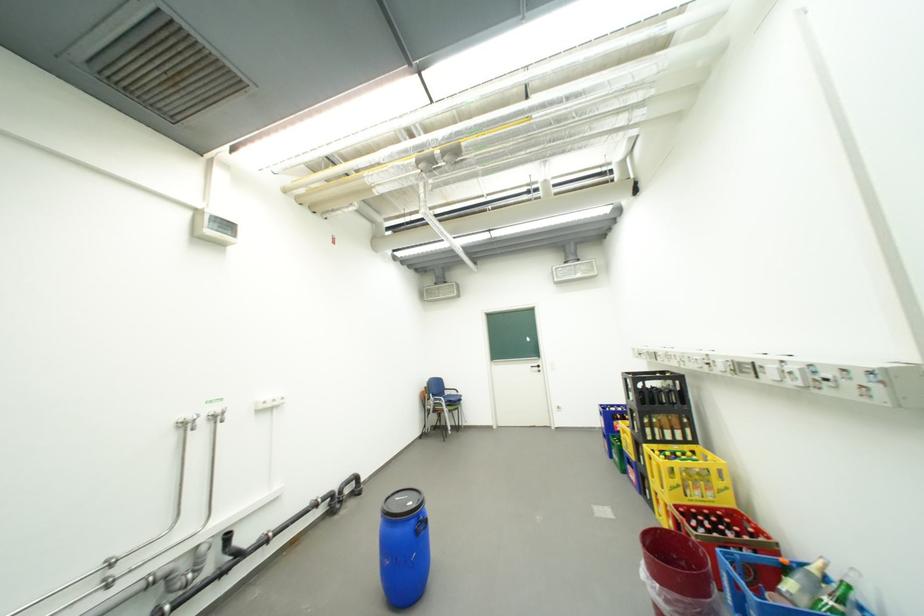
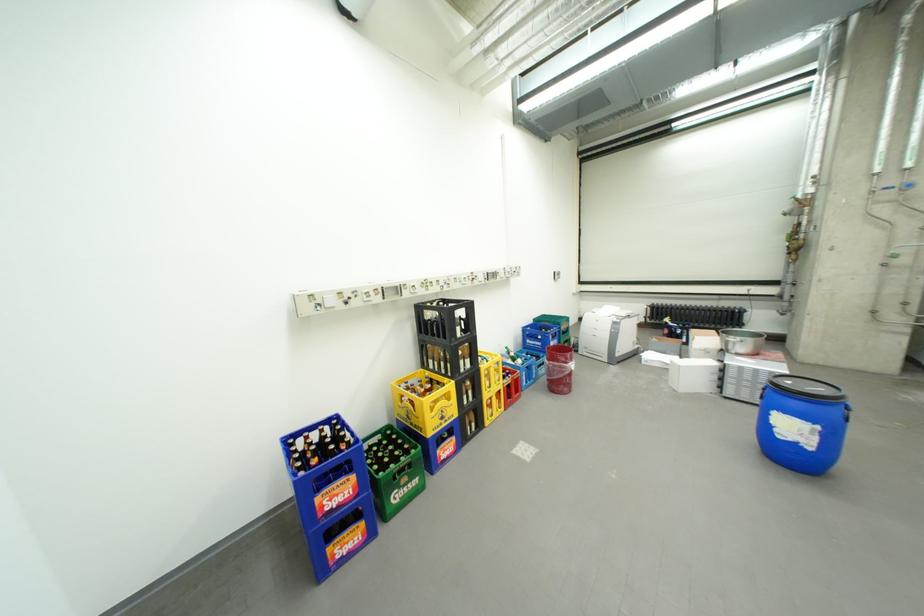
The point at (420,505) is marked in the first image. Where is the corresponding point in the second image?

(799, 383)